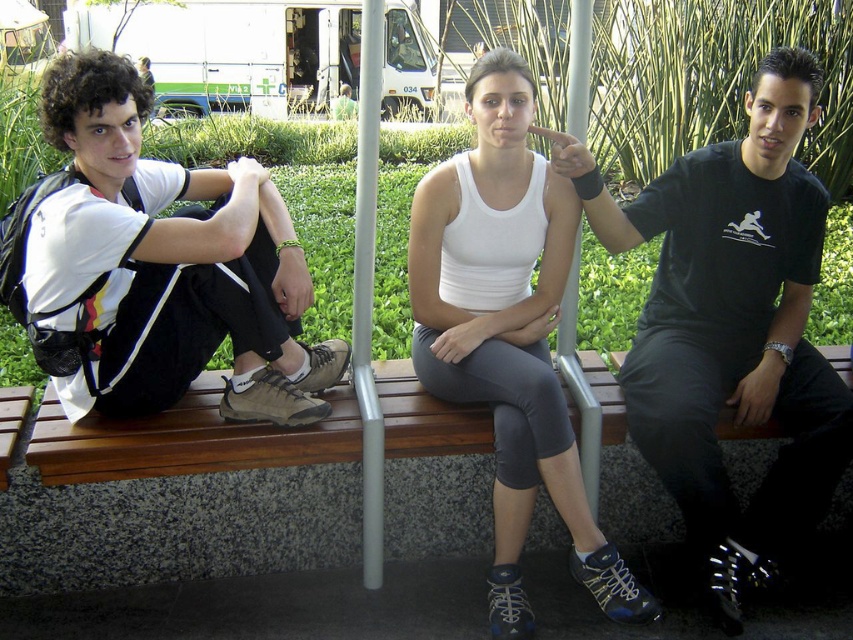
In the scene shown: You are standing in front of the bench where the three people are sitting. You notice two points marked on the bench. The first point is at coordinates point (445, 358) and the second point is at point (416, 387). Which of these two points is closer to you?

Point (445, 358) is closer to you than point (416, 387).

Based on the photo, you are a delivery person who needs to place a small package between the black matte shirt at center and the brown wooden bench at center. Can you fit the package in the space between them?

The black matte shirt at center and the brown wooden bench at center are 1.24 meters apart from each other. Since the package is small, it can easily fit in the space between them.